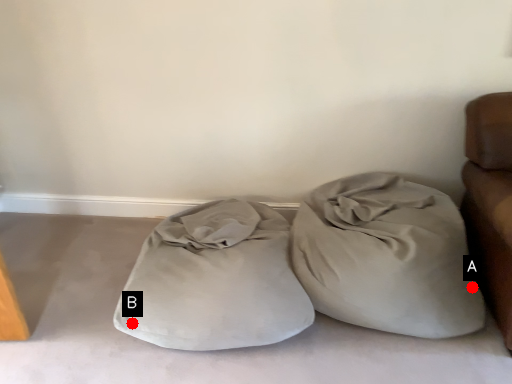
Question: Two points are circled on the image, labeled by A and B beside each circle. Which point is farther from the camera taking this photo?

Choices:
 (A) A is further
 (B) B is further

Answer: (A)